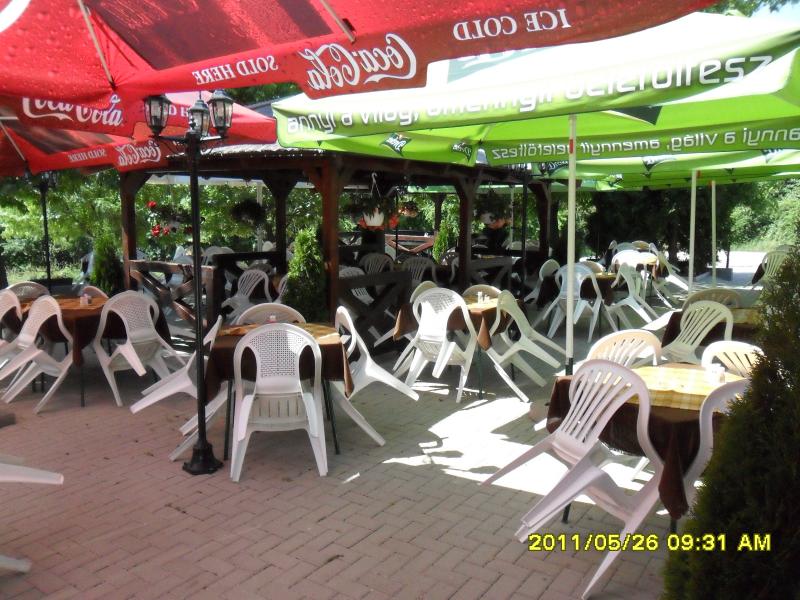
You are a GUI agent. You are given a task and a screenshot of the screen. Output one action in this format:
    pyautogui.click(x=<x>, y=<y>)
    Task: Click on the table
    
    Given the screenshot: What is the action you would take?
    pyautogui.click(x=697, y=392), pyautogui.click(x=754, y=320), pyautogui.click(x=472, y=312), pyautogui.click(x=605, y=285), pyautogui.click(x=268, y=337), pyautogui.click(x=145, y=300)